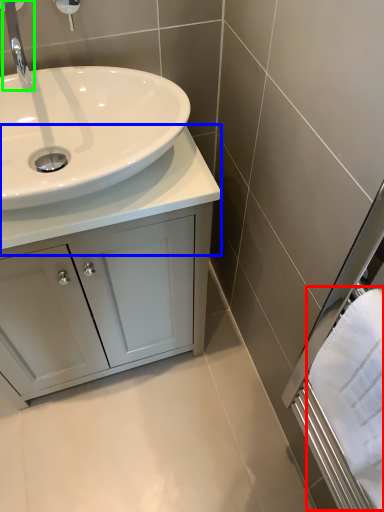
Question: Which is nearer to the bath towel (highlighted by a red box)? counter top (highlighted by a blue box) or tap (highlighted by a green box).

Choices:
 (A) counter top
 (B) tap

Answer: (A)